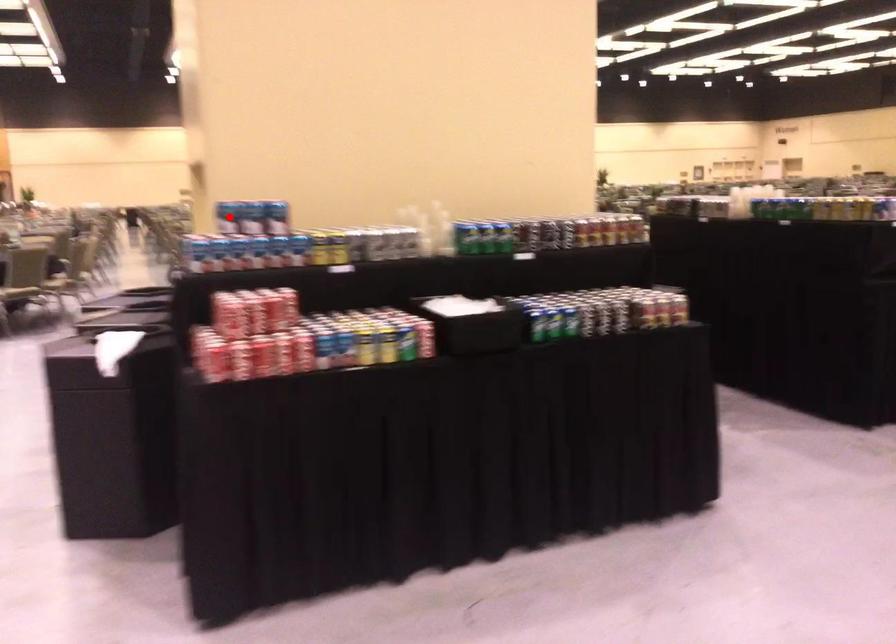
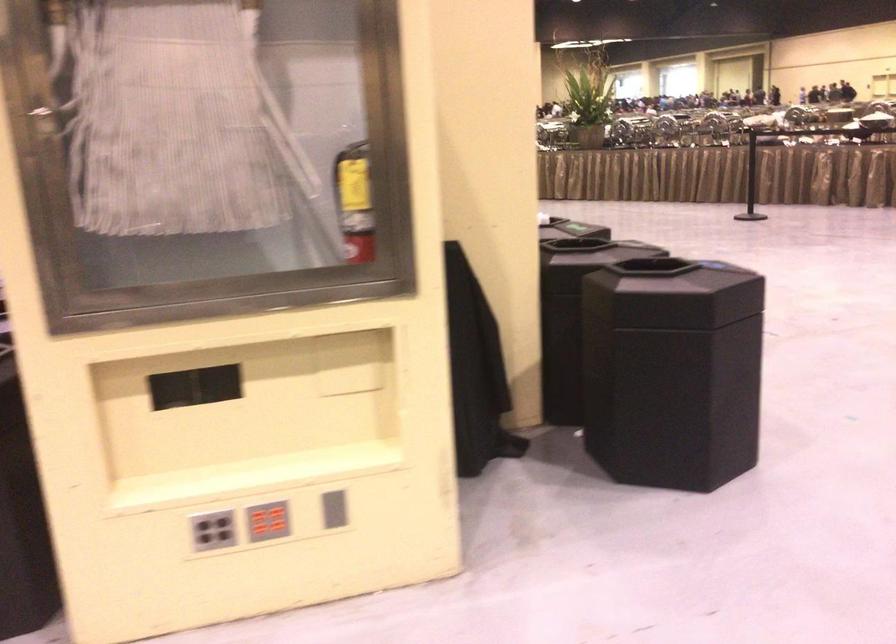
Question: I am providing you with two images of the same scene from different viewpoints. A red point is marked on the first image. Is the red point's position out of view in image 2?

Choices:
 (A) Yes
 (B) No

Answer: (A)